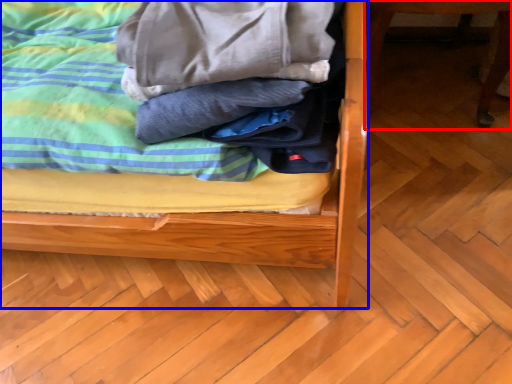
Question: Which object is further to the camera taking this photo, furniture (highlighted by a red box) or bed (highlighted by a blue box)?

Choices:
 (A) furniture
 (B) bed

Answer: (A)